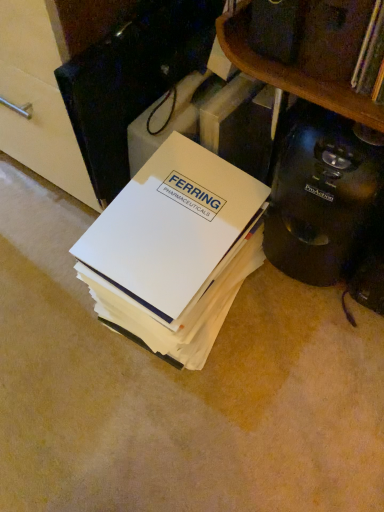
Image resolution: width=384 pixels, height=512 pixels. Find the location of `free location to the right of white paper at center`. free location to the right of white paper at center is located at coordinates (297, 342).